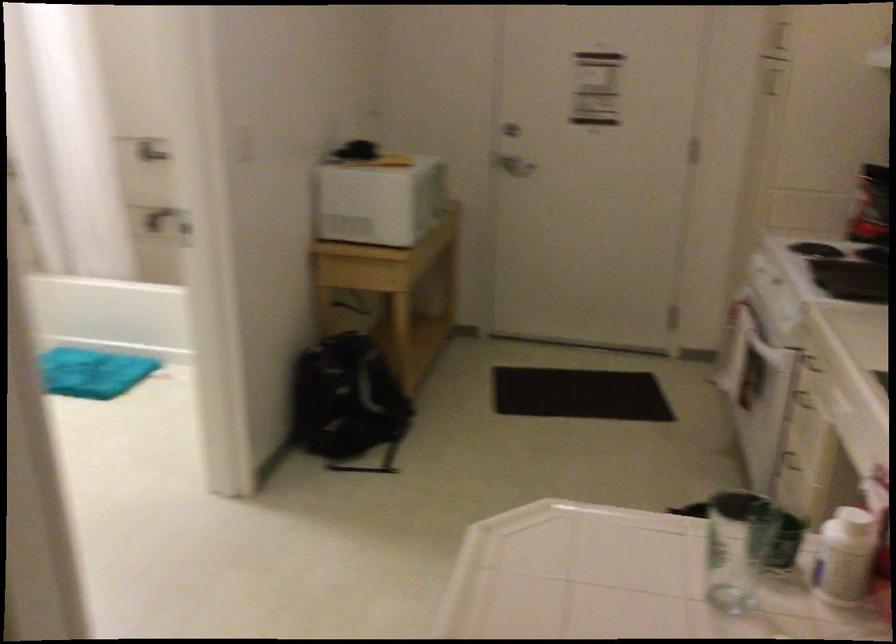
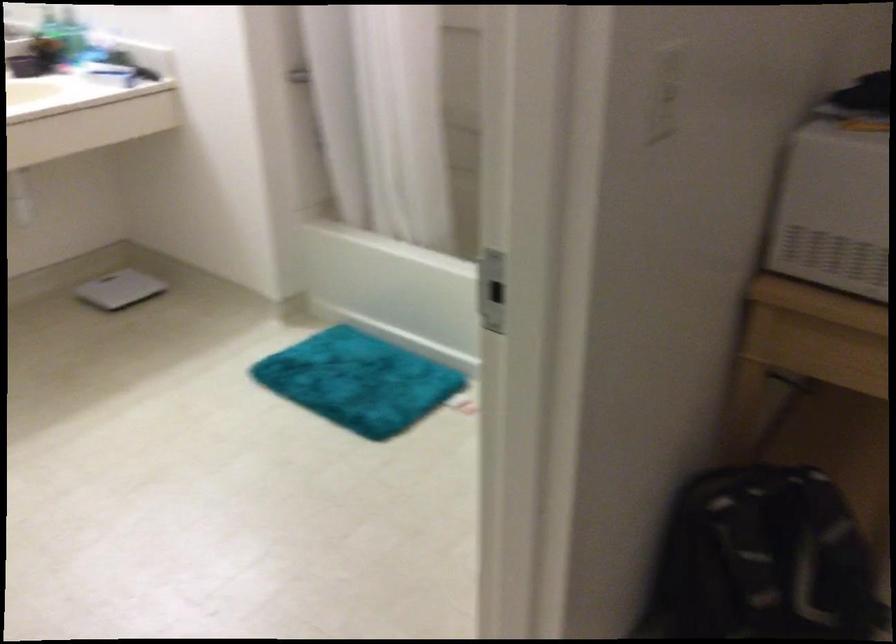
Find the pixel in the second image that matches pixel 247 136 in the first image.

(666, 93)